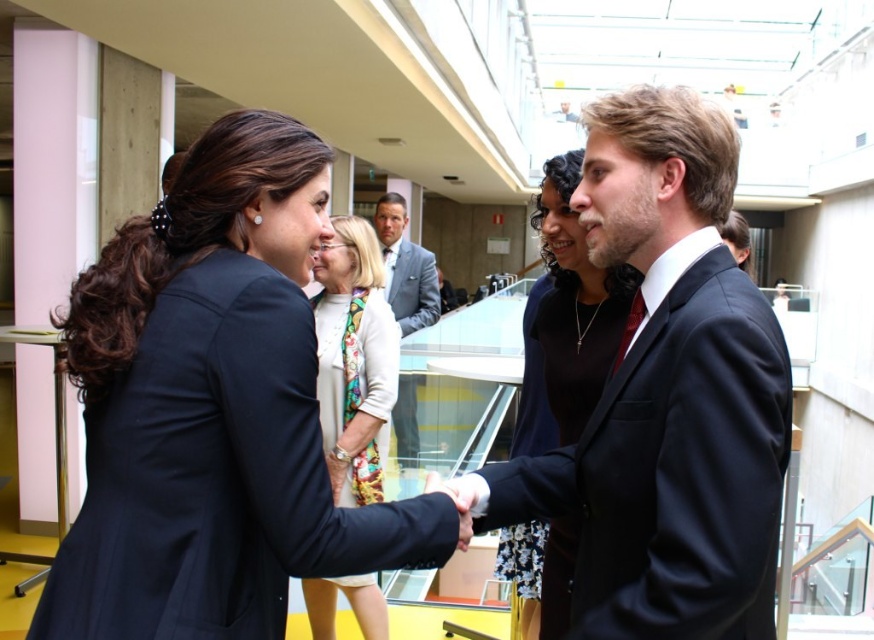
You are standing in the atrium and need to locate the shiny black suit at center. According to the coordinates provided, where would you find it?

The shiny black suit at center is located at coordinates point (666,396).

You are an event planner organizing a photoshoot in this space. You need to place a 3m wide backdrop behind the shiny black suit at center and the white silk scarf at center. Which object requires a wider space between them to accommodate the backdrop?

The shiny black suit at center requires a wider space because its width surpasses that of the white silk scarf at center, so the backdrop must be placed accordingly to accommodate its greater width.